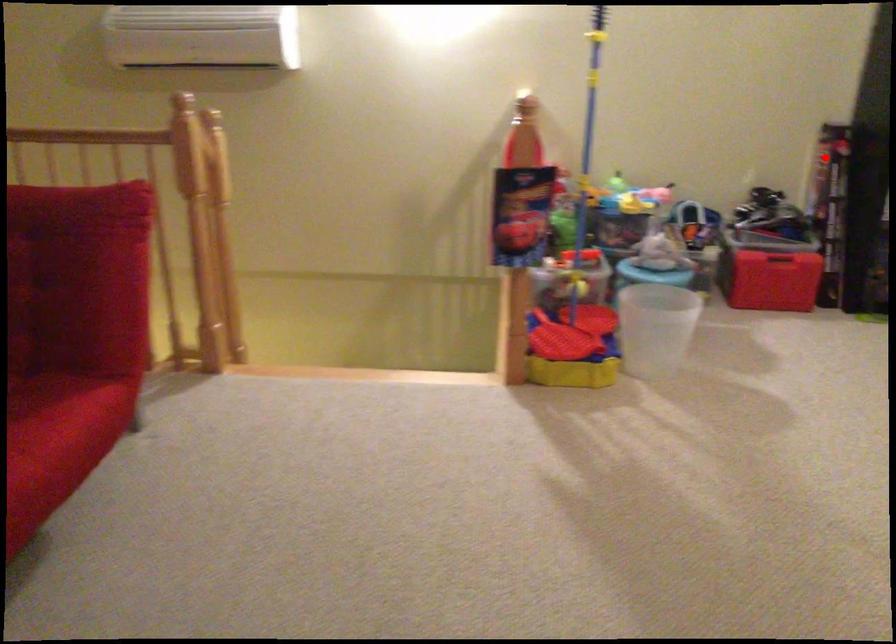
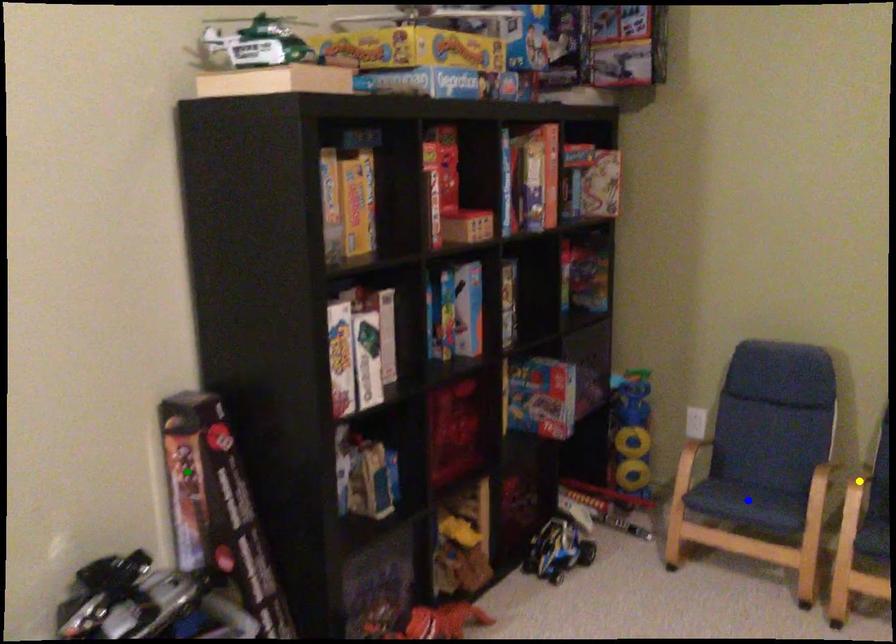
Question: I am providing you with two images of the same scene from different viewpoints. A red point is marked on the first image. You are given multiple points on the second image. Which point in image 2 is actually the same real-world point as the red point in image 1?

Choices:
 (A) green point
 (B) blue point
 (C) yellow point

Answer: (A)